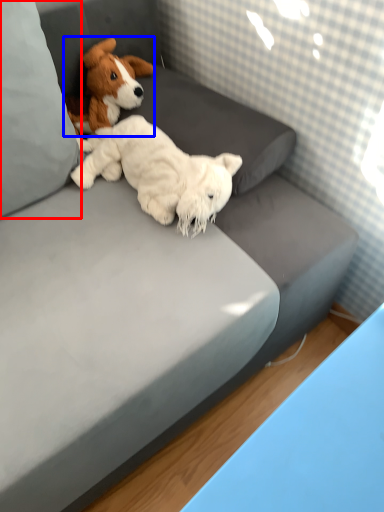
Question: Which object is further to the camera taking this photo, pillow (highlighted by a red box) or dog (highlighted by a blue box)?

Choices:
 (A) pillow
 (B) dog

Answer: (B)